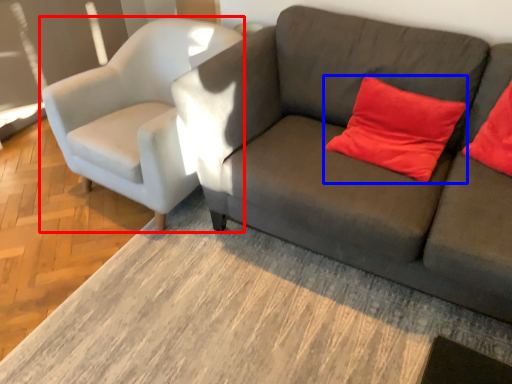
Question: Which object is further to the camera taking this photo, chair (highlighted by a red box) or pillow (highlighted by a blue box)?

Choices:
 (A) chair
 (B) pillow

Answer: (A)